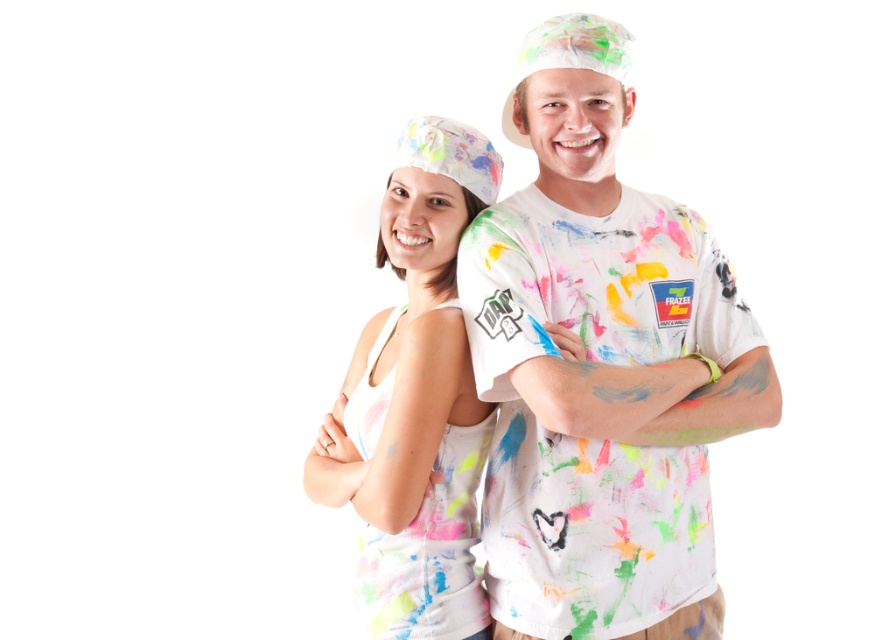
This screenshot has width=896, height=640. I want to click on paint-splattered t-shirt at center, so [601, 365].

Which is in front, point (496, 467) or point (463, 524)?

Positioned in front is point (496, 467).

Find the location of a particular element. paint-splattered t-shirt at center is located at coordinates (601, 365).